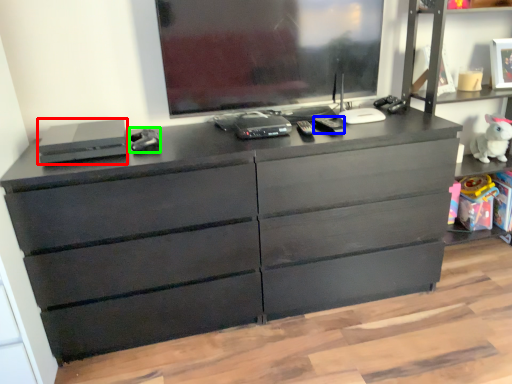
Question: Which is nearer to the equipment (highlighted by a red box)? equipment (highlighted by a blue box) or equipment (highlighted by a green box).

Choices:
 (A) equipment
 (B) equipment

Answer: (B)